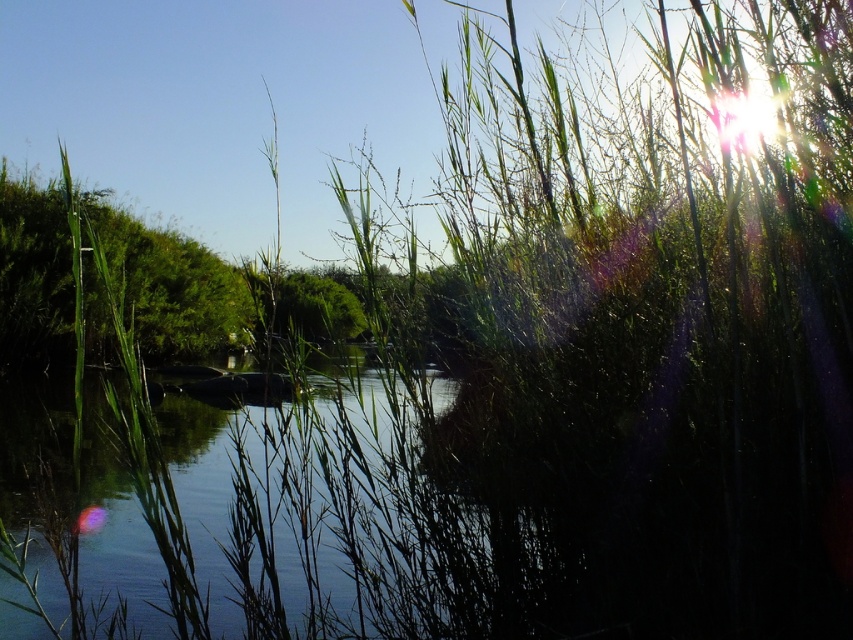
Does clear water at center lie behind green leafy bush at left?

That is False.

Image resolution: width=853 pixels, height=640 pixels. I want to click on clear water at center, so click(x=276, y=529).

Where is `clear water at center`? This screenshot has width=853, height=640. clear water at center is located at coordinates (276, 529).